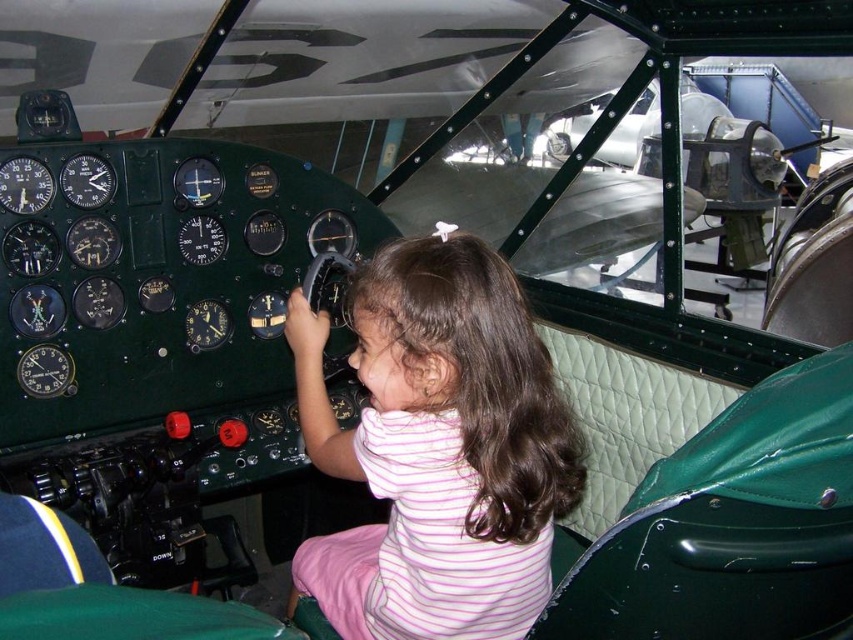
Question: Does pink striped shirt at center appear on the left side of green leather seat at lower left?

Choices:
 (A) yes
 (B) no

Answer: (B)

Question: Is pink striped shirt at center bigger than green leather seat at lower left?

Choices:
 (A) yes
 (B) no

Answer: (A)

Question: Among these points, which one is farthest from the camera?

Choices:
 (A) (1, 532)
 (B) (370, 625)

Answer: (B)

Question: Does pink striped shirt at center appear on the left side of green leather seat at lower left?

Choices:
 (A) no
 (B) yes

Answer: (A)